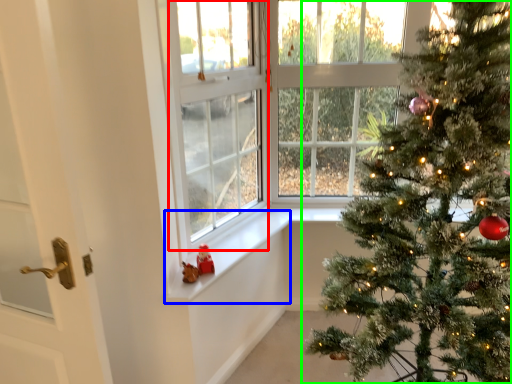
Question: Which is nearer to the window screen (highlighted by a red box)? window sill (highlighted by a blue box) or christmas tree (highlighted by a green box).

Choices:
 (A) window sill
 (B) christmas tree

Answer: (A)